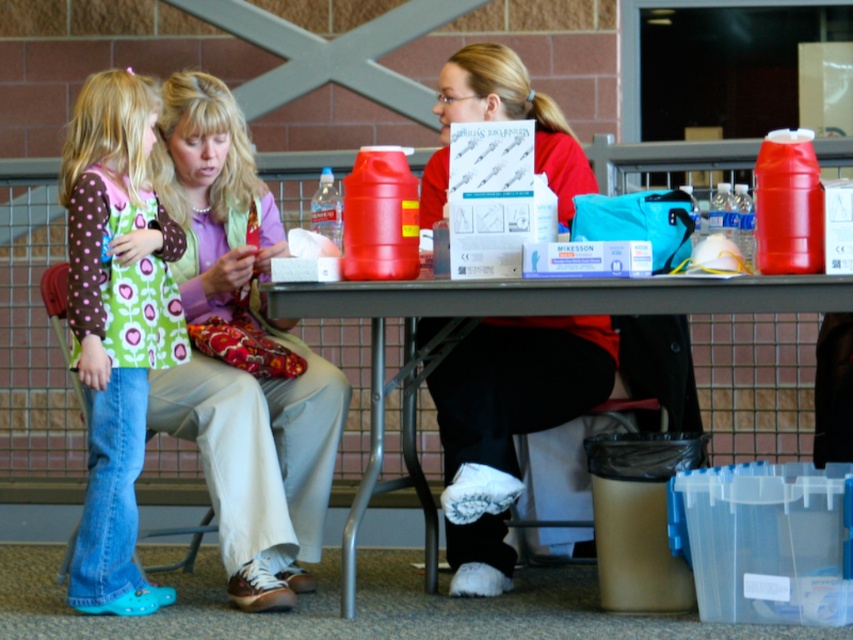
You are organizing a small event and need to place a 12 inch tall decoration on the table. The polka dot fabric dress at lower left and the matte red shirt at center are already there. Which item can the decoration be placed on top of without it being hidden?

The polka dot fabric dress at lower left has a greater height compared to matte red shirt at center, so placing the decoration on top of the polka dot fabric dress at lower left would allow it to be seen since it is taller.

You are organizing a community event and need to place a name tag on the table. The name tag is 10 cm wide. There is a space between the matte purple sweater at center and the matte red shirt at center. Can the name tag fit in that space?

The matte purple sweater at center is to the left of the matte red shirt at center. The space between them must be at least 10 cm wide for the name tag to fit. However, the exact width isn

You are organizing items on the table and need to place a new item that requires more space than the matte purple sweater at center. Can the metallic gray table at center accommodate it?

The metallic gray table at center has a greater width than the matte purple sweater at center. Since the new item requires more space than the sweater, the table can accommodate it as it is wider.